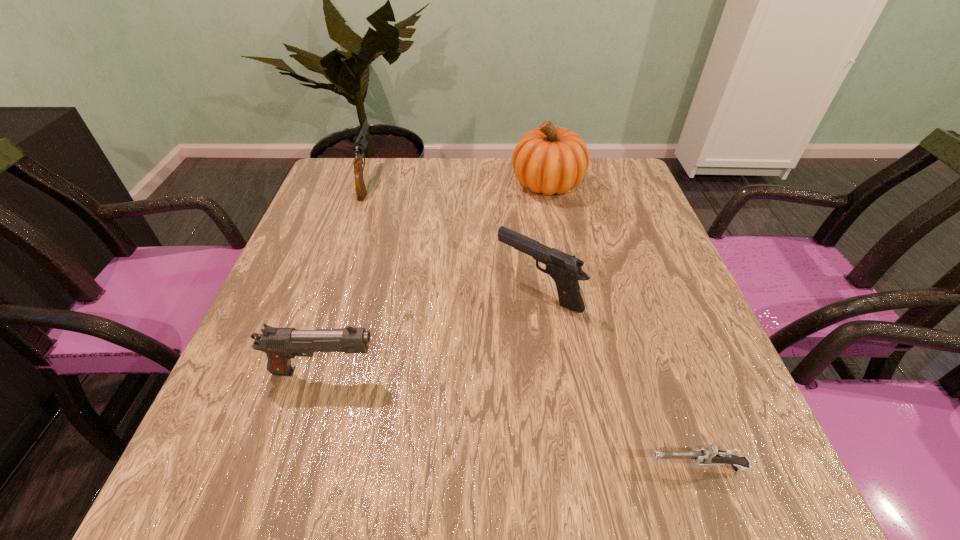
Image resolution: width=960 pixels, height=540 pixels. I want to click on object that can be found as the fourth closest to the rightmost gun, so click(x=360, y=145).

The width and height of the screenshot is (960, 540). Find the location of `object that is the closest one to the rightmost gun`. object that is the closest one to the rightmost gun is located at coordinates (564, 269).

Locate which gun is the second closest to the pumpkin. Please provide its 2D coordinates. Your answer should be formatted as a tuple, i.e. [(x, y)], where the tuple contains the x and y coordinates of a point satisfying the conditions above.

[(360, 145)]

Identify which gun is located as the nearest to the farthest gun. Please provide its 2D coordinates. Your answer should be formatted as a tuple, i.e. [(x, y)], where the tuple contains the x and y coordinates of a point satisfying the conditions above.

[(564, 269)]

Locate an element on the screen. This screenshot has width=960, height=540. free spot that satisfies the following two spatial constraints: 1. on the front side of the tallest object; 2. at the muzzle of the third nearest object is located at coordinates (569, 291).